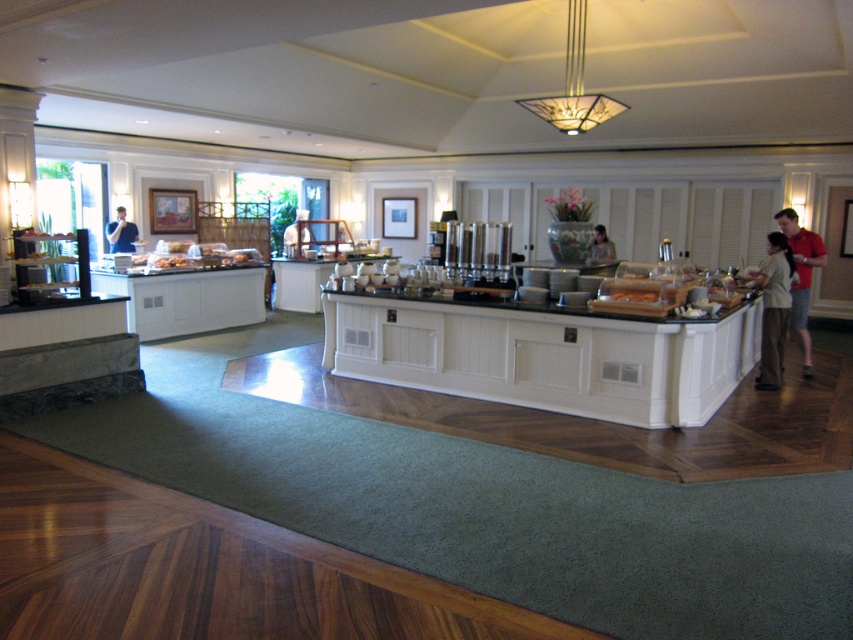
Question: Among these objects, which one is nearest to the camera?

Choices:
 (A) smooth white shirt at center
 (B) red cotton shirt at right
 (C) light beige pants at right
 (D) matte black shirt at center

Answer: (C)

Question: Which object appears farthest from the camera in this image?

Choices:
 (A) red cotton shirt at right
 (B) matte black shirt at center
 (C) blue shirt at left

Answer: (C)

Question: Observing the image, what is the correct spatial positioning of red cotton shirt at right in reference to smooth white shirt at center?

Choices:
 (A) left
 (B) right

Answer: (B)

Question: Is red cotton shirt at right smaller than matte black shirt at center?

Choices:
 (A) yes
 (B) no

Answer: (B)

Question: Which is nearer to the smooth white shirt at center?

Choices:
 (A) light beige pants at right
 (B) blue shirt at left

Answer: (B)

Question: Does blue shirt at left have a greater width compared to matte black shirt at center?

Choices:
 (A) no
 (B) yes

Answer: (A)